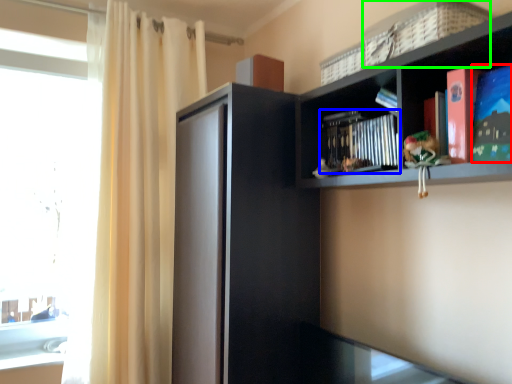
Question: Estimate the real-world distances between objects in this image. Which object is farther from paperback book (highlighted by a red box), book (highlighted by a blue box) or basket (highlighted by a green box)?

Choices:
 (A) book
 (B) basket

Answer: (A)